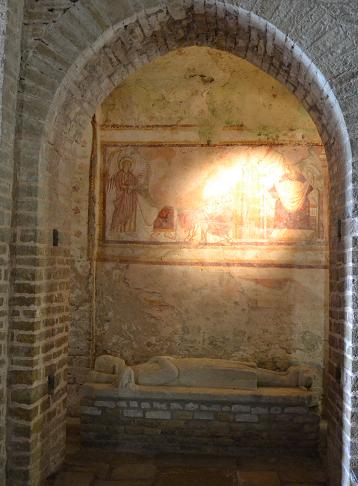
Identify the location of archway. (221, 26).